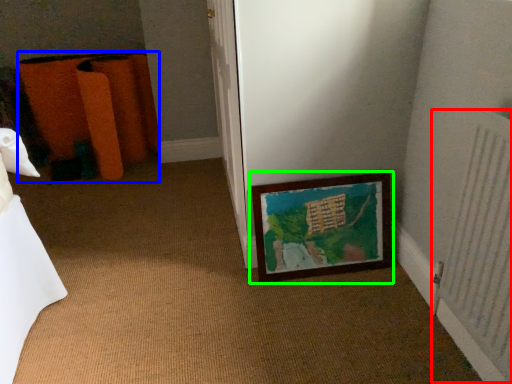
Question: Based on their relative distances, which object is nearer to radiator (highlighted by a red box)? Choose from furniture (highlighted by a blue box) and picture frame (highlighted by a green box).

Choices:
 (A) furniture
 (B) picture frame

Answer: (B)